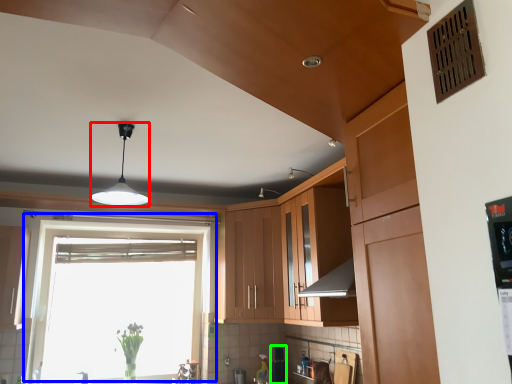
Question: Which object is positioned closest to light fixture (highlighted by a red box)? Select from window (highlighted by a blue box) and appliance (highlighted by a green box).

Choices:
 (A) window
 (B) appliance

Answer: (B)